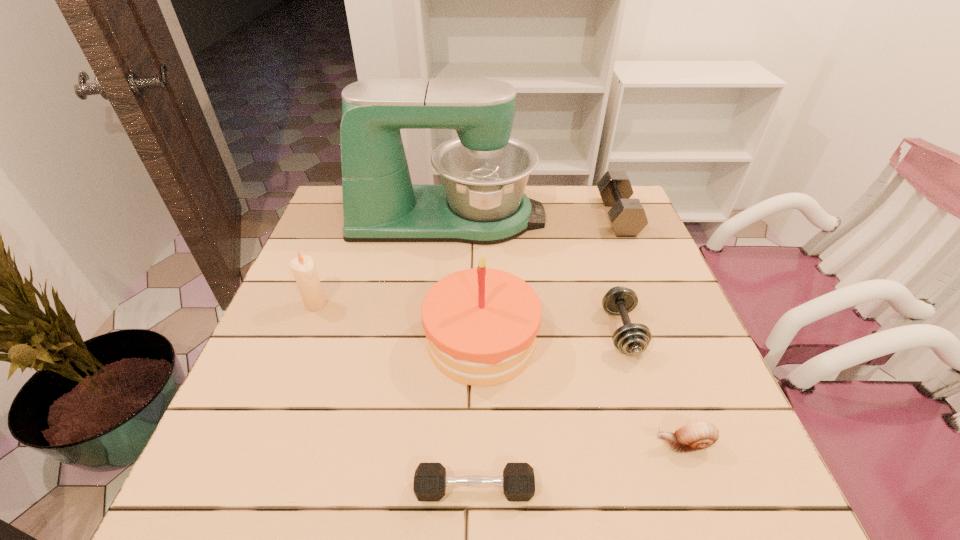
This screenshot has height=540, width=960. I want to click on mixer that is at the far edge, so click(x=484, y=171).

The height and width of the screenshot is (540, 960). In order to click on dumbbell that is positioned at the far edge in this screenshot , I will do `click(627, 216)`.

Locate an element on the screen. This screenshot has width=960, height=540. object located at the near edge is located at coordinates (430, 480).

This screenshot has height=540, width=960. Identify the location of mixer at the left edge. (484, 171).

Where is `candle at the left edge`? The width and height of the screenshot is (960, 540). candle at the left edge is located at coordinates (303, 267).

Locate an element on the screen. The image size is (960, 540). escargot at the right edge is located at coordinates (x=697, y=435).

I want to click on object positioned at the far left corner, so click(484, 171).

Find the location of `object that is at the far right corner`. object that is at the far right corner is located at coordinates (627, 216).

The width and height of the screenshot is (960, 540). Find the location of `free space at the far edge of the desktop`. free space at the far edge of the desktop is located at coordinates (552, 211).

I want to click on vacant area at the near edge, so click(567, 498).